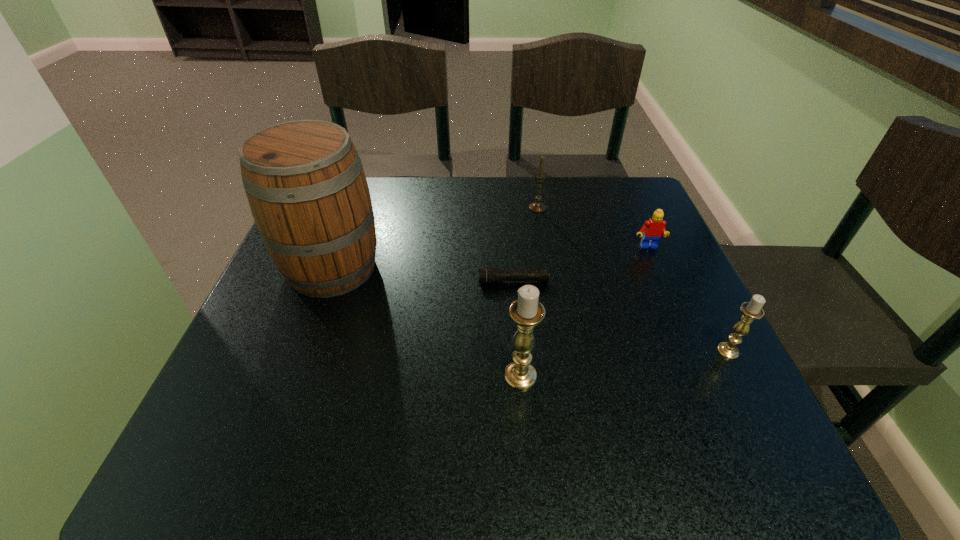
Find the location of `object present at the left edge`. object present at the left edge is located at coordinates (304, 180).

What are the coordinates of `candle holder located in the right edge section of the desktop` in the screenshot? It's located at (751, 310).

The height and width of the screenshot is (540, 960). Identify the location of Lego present at the right edge. (653, 229).

Find the location of `vacant area at the far edge`. vacant area at the far edge is located at coordinates (577, 195).

In the image, there is a desktop. At what (x,y) coordinates should I click in order to perform the action: click on vacant space at the near edge. Please return your answer as a coordinate pair (x, y). The height and width of the screenshot is (540, 960). Looking at the image, I should click on (636, 375).

Locate an element on the screen. This screenshot has width=960, height=540. free location at the far right corner is located at coordinates (598, 190).

Locate an element on the screen. This screenshot has width=960, height=540. vacant space that is in between the leftmost object and the shortest object is located at coordinates (422, 275).

I want to click on empty space that is in between the farthest object and the right candle holder, so click(633, 279).

The height and width of the screenshot is (540, 960). Identify the location of vacant space that is in between the leftmost object and the flashlight. (422, 275).

This screenshot has height=540, width=960. I want to click on free space between the right candle holder and the shortest object, so click(x=621, y=316).